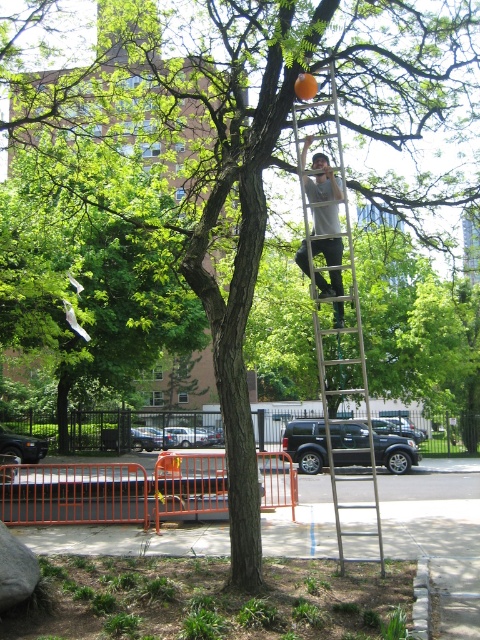
Consider the image. You are standing in the park and see two points marked in the image. Which point, point (317, 314) or point (317, 198), is closer to you?

Point (317, 314) is closer to the viewer than point (317, 198).

You are a painter who needs to reach the top of the tree. The silver metallic ladder at center is your only tool. Can you use it to reach the top of the tree while avoiding the gray cotton shirt at upper center?

The silver metallic ladder at center is wider than the gray cotton shirt at upper center, so yes, you can use the ladder to reach the top of the tree without disturbing the shirt.

Looking at this image, you are a painter who needs to reach the top of the silver metallic ladder at center to touch up some paint on the tree. Considering the height of the gray cotton shirt at upper center, can you estimate if the ladder is tall enough to reach the required height?

The silver metallic ladder at center is taller than the gray cotton shirt at upper center, so it is likely tall enough for the painter to reach the top of the tree canopy.